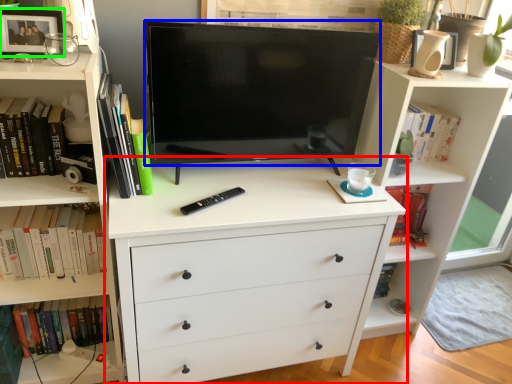
Question: Which is nearer to the chest of drawers (highlighted by a red box)? television (highlighted by a blue box) or picture frame (highlighted by a green box).

Choices:
 (A) television
 (B) picture frame

Answer: (A)